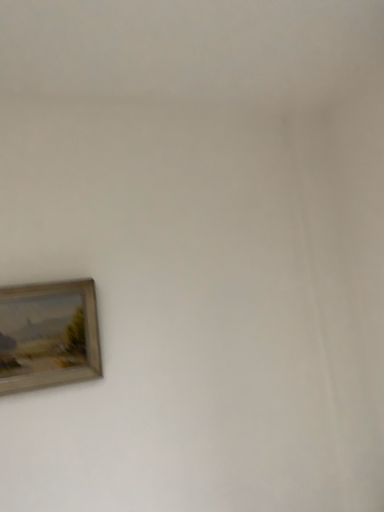
This screenshot has width=384, height=512. Identify the location of wooden framed painting at lower left. (48, 335).

This screenshot has width=384, height=512. What do you see at coordinates (48, 335) in the screenshot? I see `wooden framed painting at lower left` at bounding box center [48, 335].

Locate an element on the screen. wooden framed painting at lower left is located at coordinates (48, 335).